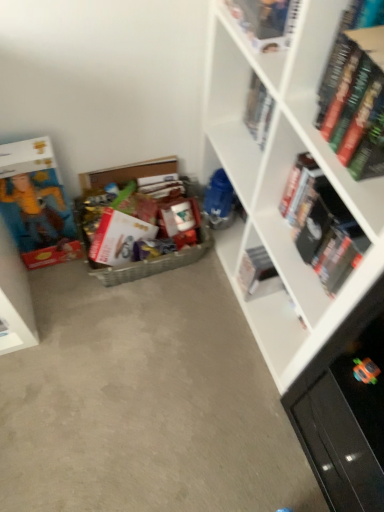
Locate an element on the screen. vacant space in front of white matte book at center, the 4th book viewed from the left is located at coordinates (237, 350).